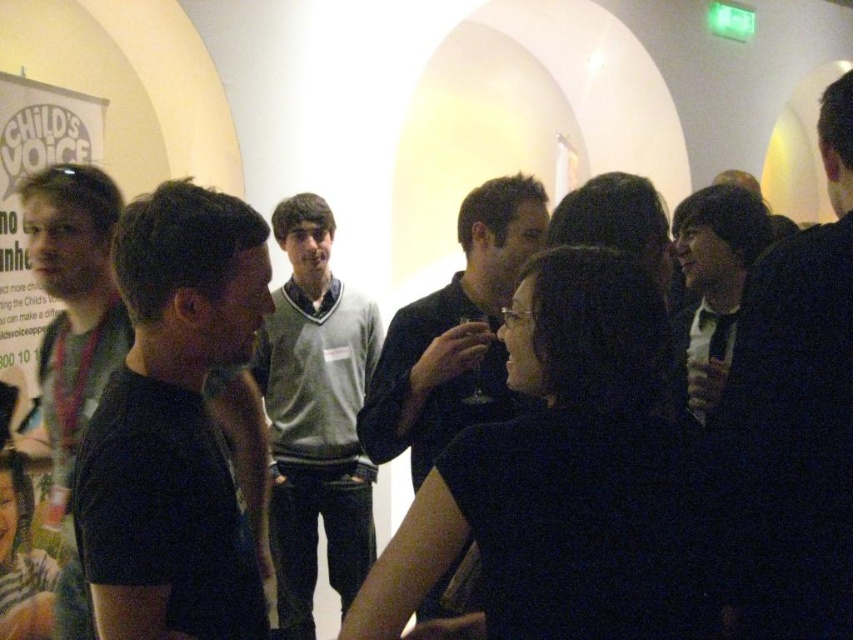
You are standing at the entrance of the event and want to move towards the point at coordinates point (759, 500) and point (305, 396). Which point should you reach first if you want to follow the path that goes from the entrance to the back of the room?

You should reach point (759, 500) first because it is in front of point (305, 396) along the path from the entrance to the back of the room.

Based on the photo, you are at a social event and want to find the shortest person in the group. Which of the following is shorter? black matte shirt at left or gray sweater at center?

The black matte shirt at left is shorter than the gray sweater at center.